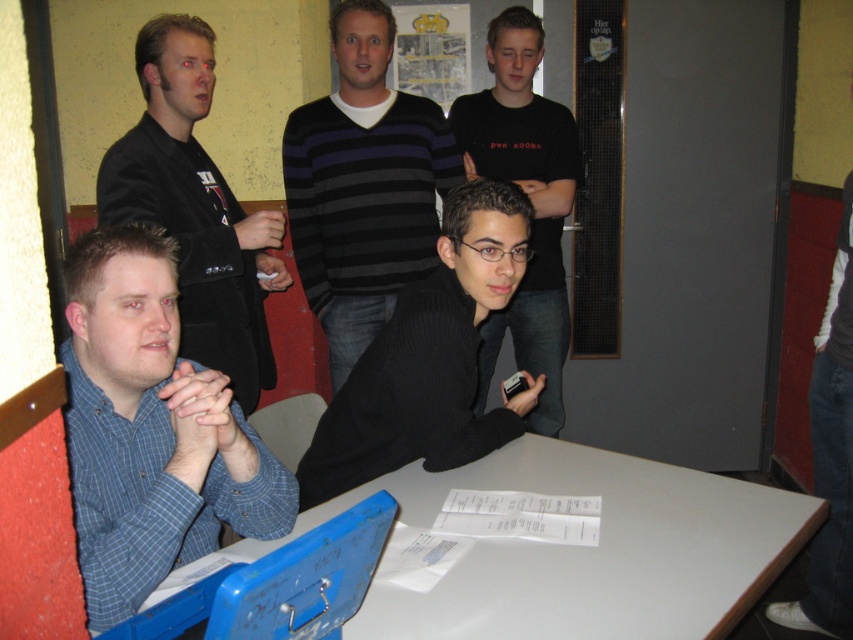
Is point (154, 499) positioned behind point (556, 408)?

No.

This screenshot has width=853, height=640. Identify the location of blue checkered shirt at left. (151, 429).

Who is higher up, white glossy table at lower center or matte black jacket at left?

matte black jacket at left

Does point (527, 550) come behind point (196, 80)?

That is False.

Is point (375, 618) more distant than point (225, 369)?

That is False.

At what (x,y) coordinates should I click in order to perform the action: click on white glossy table at lower center. Please return your answer as a coordinate pair (x, y). The image size is (853, 640). Looking at the image, I should click on (585, 550).

The height and width of the screenshot is (640, 853). Find the location of `white glossy table at lower center`. white glossy table at lower center is located at coordinates (585, 550).

Can you confirm if white glossy table at lower center is positioned to the right of black ribbed sweater at center?

Yes, white glossy table at lower center is to the right of black ribbed sweater at center.

Between point (351, 624) and point (439, 282), which one is positioned behind?

The point (439, 282) is behind.

Image resolution: width=853 pixels, height=640 pixels. In order to click on white glossy table at lower center in this screenshot , I will do `click(585, 550)`.